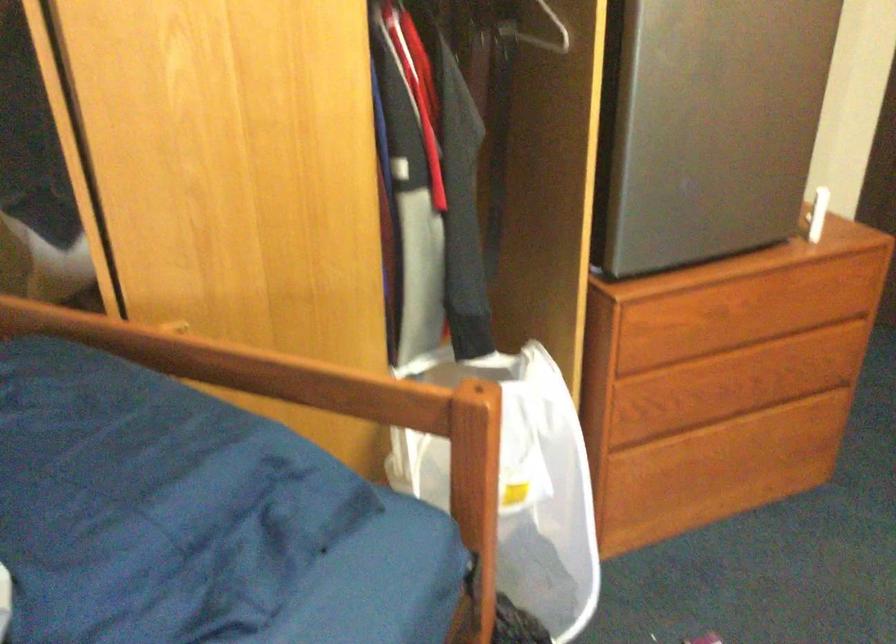
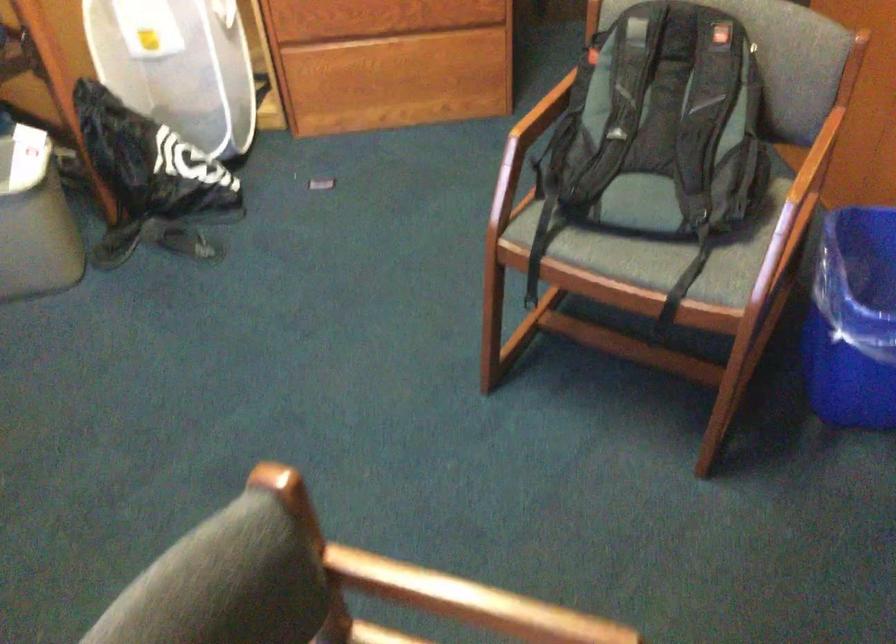
The images are taken continuously from a first-person perspective. In which direction are you moving?

The cameraman walked toward right, backward.